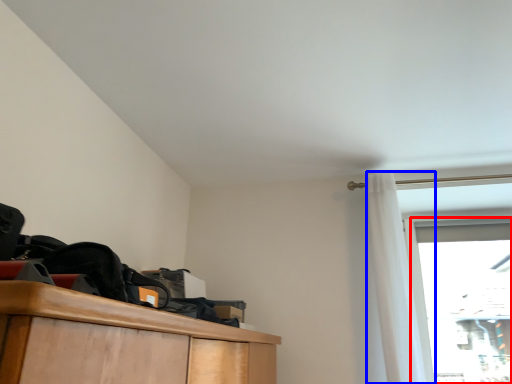
Question: Among these objects, which one is farthest to the camera, glass door (highlighted by a red box) or curtain (highlighted by a blue box)?

Choices:
 (A) glass door
 (B) curtain

Answer: (A)